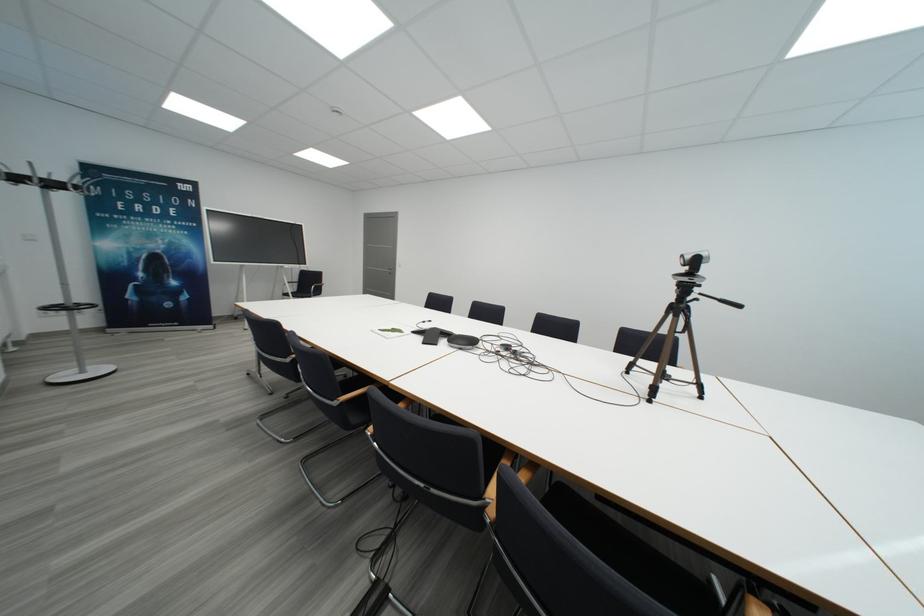
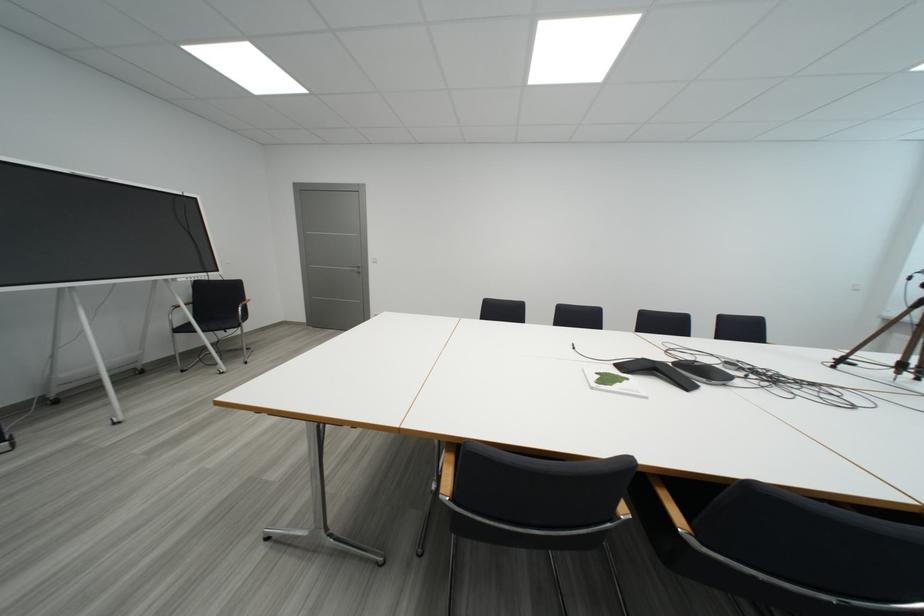
Where in the second image is the point corresponding to point (442, 331) from the first image?

(651, 363)